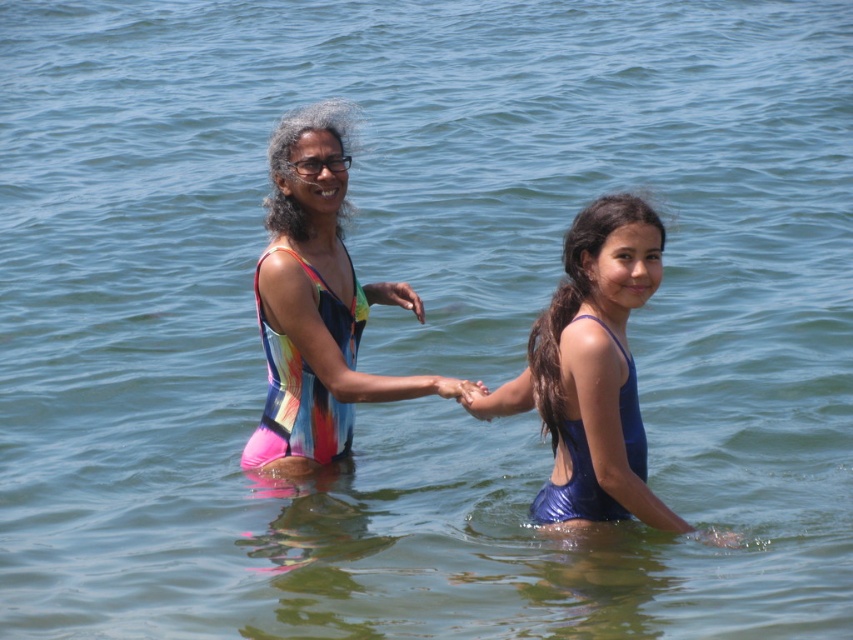
You are a photographer trying to capture a closeup of the multicolored swimsuit at center without the matte skin hand at center blocking the view. Based on their positions, can you position yourself so that the hand doesn

The matte skin hand at center is behind the multicolored swimsuit at center, so if you position yourself in front of the multicolored swimsuit at center, you should be able to take the photo without the hand blocking the view.

You are a photographer trying to capture a closeup of the multicolored swimsuit at center and the matte plastic hand at center. Which object should you zoom in on to ensure both fit in the frame without cropping?

The multicolored swimsuit at center is wider than the matte plastic hand at center, so you should zoom in on the multicolored swimsuit at center to ensure both fit in the frame without cropping.